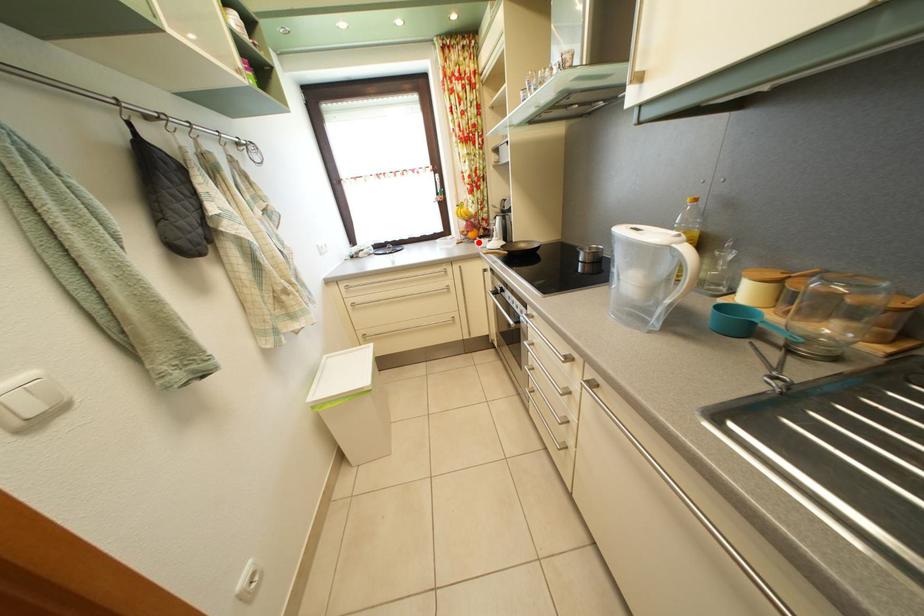
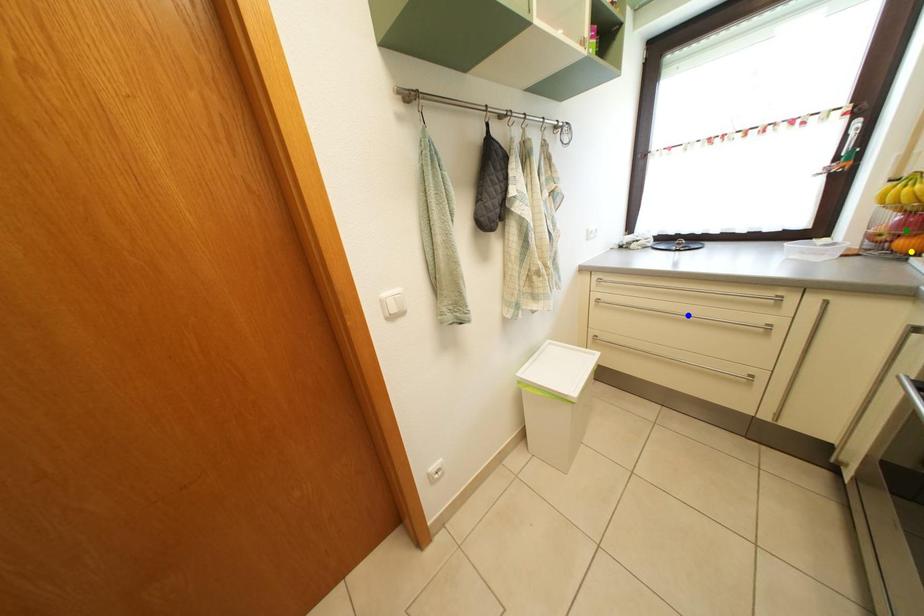
Question: I am providing you with two images of the same scene from different viewpoints. A red point is marked on the first image. You are given multiple points on the second image. Which point in image 2 is actually the same real-world point as the red point in image 1?

Choices:
 (A) blue point
 (B) green point
 (C) yellow point

Answer: (C)